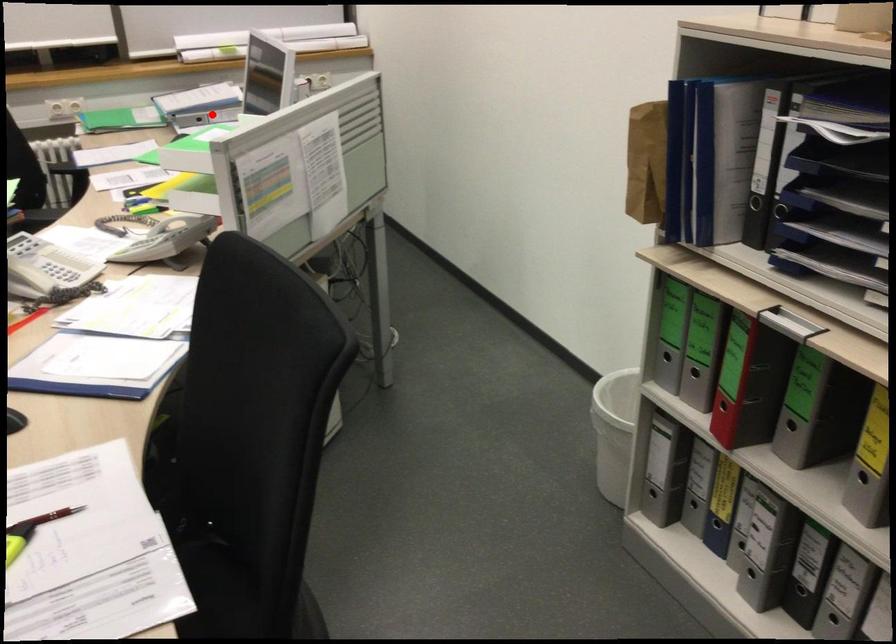
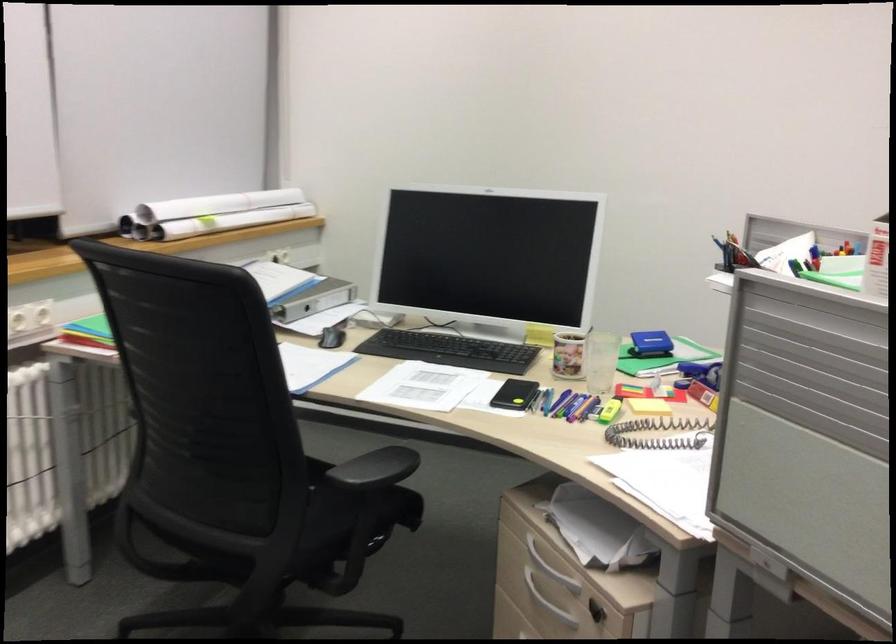
The point at the highlighted location is marked in the first image. Where is the corresponding point in the second image?

(314, 299)